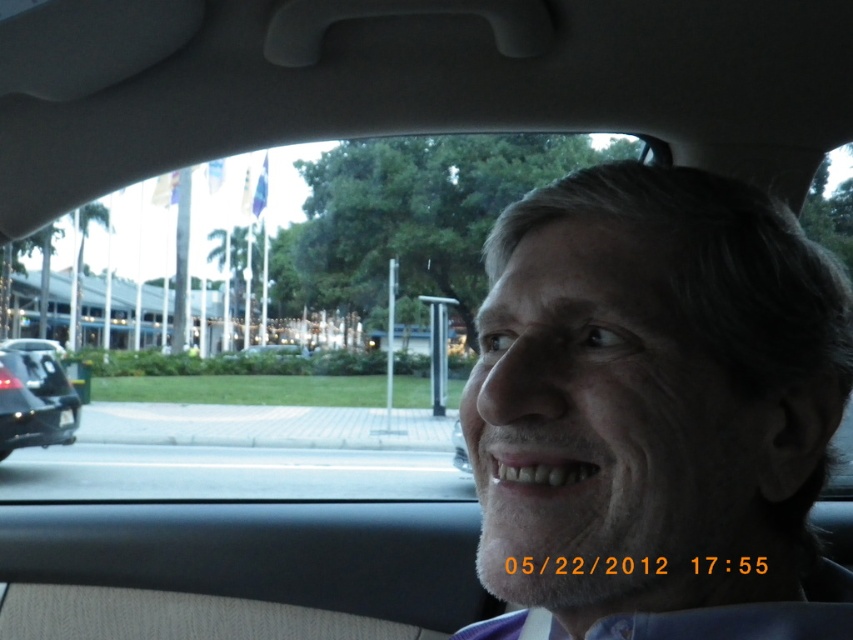
Which of these two, gray matte face at center or black glossy car at left, stands shorter?

gray matte face at center is shorter.

Is gray matte face at center further to camera compared to black glossy car at left?

No, it is not.

Is point (677, 256) less distant than point (71, 424)?

Yes, it is in front of point (71, 424).

I want to click on gray matte face at center, so click(656, 410).